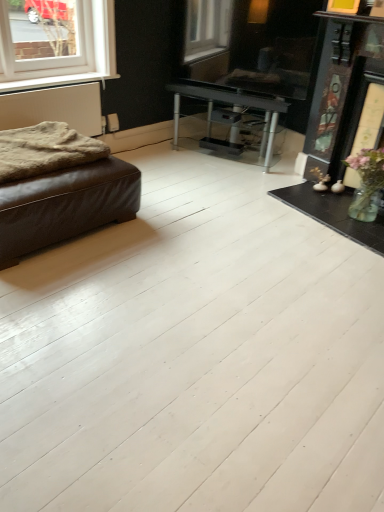
You are a GUI agent. You are given a task and a screenshot of the screen. Output one action in this format:
    pyautogui.click(x=<x>, y=<y>)
    Task: Click on the vacant area that lies to the right of brown leather ottoman at left
    This screenshot has width=384, height=512.
    Given the screenshot: What is the action you would take?
    pyautogui.click(x=195, y=223)